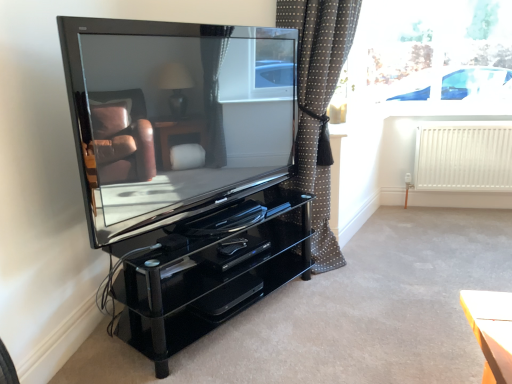
Question: Is black glossy dvd player at center to the right of polka dot fabric curtain at center from the viewer's perspective?

Choices:
 (A) yes
 (B) no

Answer: (B)

Question: Does black glossy dvd player at center have a smaller size compared to polka dot fabric curtain at center?

Choices:
 (A) no
 (B) yes

Answer: (B)

Question: From a real-world perspective, is black glossy dvd player at center positioned over polka dot fabric curtain at center based on gravity?

Choices:
 (A) no
 (B) yes

Answer: (A)

Question: Is black glossy dvd player at center at the left side of polka dot fabric curtain at center?

Choices:
 (A) yes
 (B) no

Answer: (A)

Question: From the image's perspective, would you say black glossy dvd player at center is positioned over polka dot fabric curtain at center?

Choices:
 (A) yes
 (B) no

Answer: (B)

Question: Is black glossy dvd player at center bigger than polka dot fabric curtain at center?

Choices:
 (A) no
 (B) yes

Answer: (A)

Question: Is transparent glass window at upper right at the right side of white matte radiator at right?

Choices:
 (A) yes
 (B) no

Answer: (B)

Question: Does transparent glass window at upper right have a lesser height compared to white matte radiator at right?

Choices:
 (A) yes
 (B) no

Answer: (B)

Question: Can you confirm if transparent glass window at upper right is taller than white matte radiator at right?

Choices:
 (A) yes
 (B) no

Answer: (A)

Question: Can you confirm if transparent glass window at upper right is wider than white matte radiator at right?

Choices:
 (A) no
 (B) yes

Answer: (A)

Question: Is transparent glass window at upper right next to white matte radiator at right and touching it?

Choices:
 (A) no
 (B) yes

Answer: (A)

Question: From a real-world perspective, is transparent glass window at upper right physically below white matte radiator at right?

Choices:
 (A) no
 (B) yes

Answer: (A)

Question: Considering the relative sizes of black glossy dvd player at center and white matte radiator at right in the image provided, is black glossy dvd player at center taller than white matte radiator at right?

Choices:
 (A) no
 (B) yes

Answer: (A)